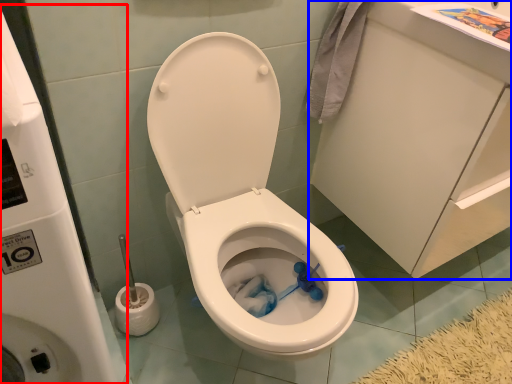
Question: Among these objects, which one is farthest to the camera, water tank (highlighted by a red box) or porcelain (highlighted by a blue box)?

Choices:
 (A) water tank
 (B) porcelain

Answer: (B)